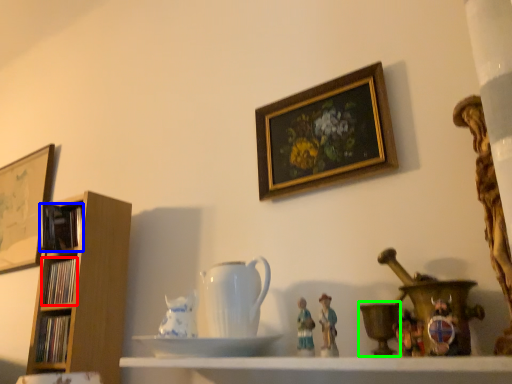
Question: Considering the real-world distances, which object is farthest from book (highlighted by a red box)? book (highlighted by a blue box) or candle holder (highlighted by a green box)?

Choices:
 (A) book
 (B) candle holder

Answer: (B)